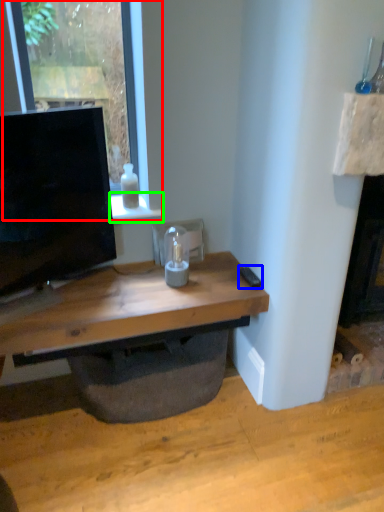
Question: Which object is positioned closest to window (highlighted by a red box)? Select from remote control (highlighted by a blue box) and window sill (highlighted by a green box).

Choices:
 (A) remote control
 (B) window sill

Answer: (B)